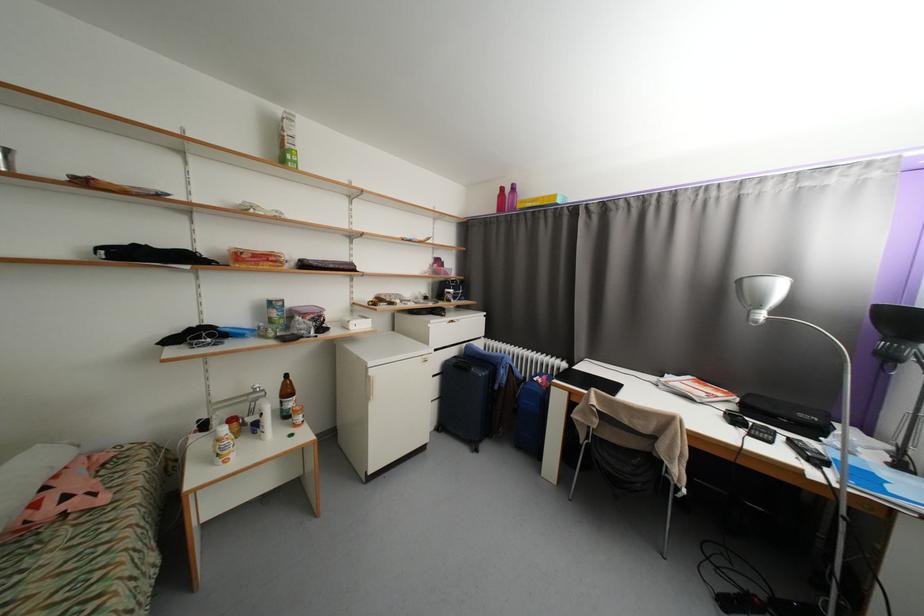
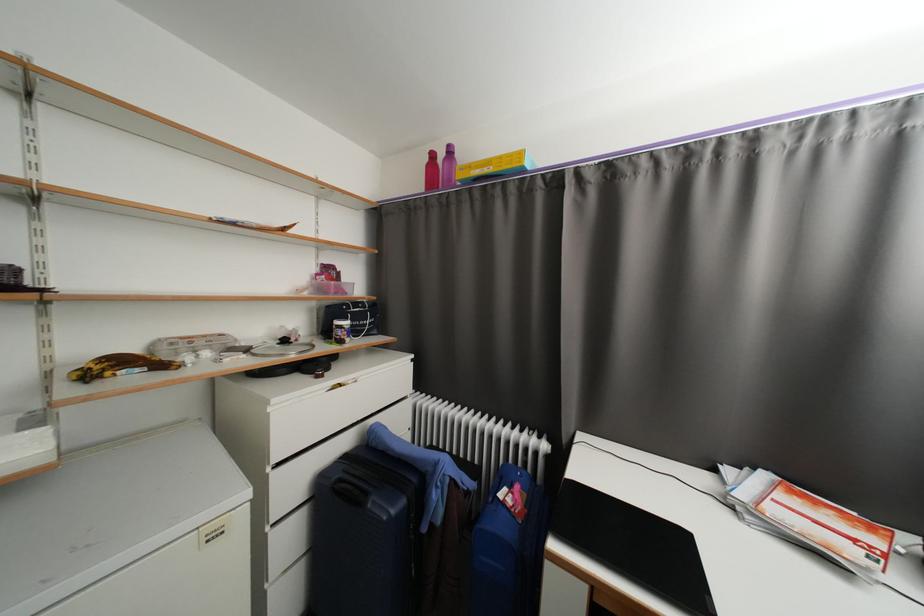
Question: I am providing you with two images of the same scene from different viewpoints. Please identify which objects are invisible in image2.

Choices:
 (A) shallow wooden bowl
 (B) small food jar
 (C) clear plastic container
 (D) none of these

Answer: (D)